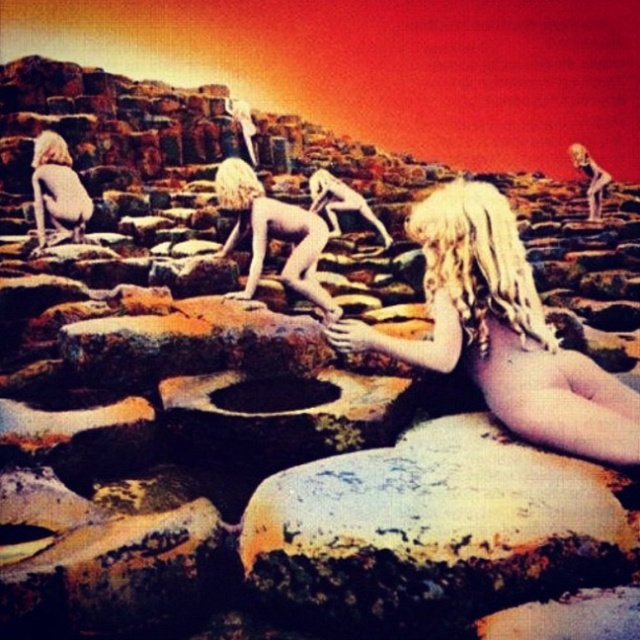
Between point (275, 211) and point (579, 163), which one is positioned behind?

Point (579, 163)

Which is more to the left, smooth skin girl at center or blonde hair at upper right?

Positioned to the left is smooth skin girl at center.

Where is `smooth skin girl at center`? This screenshot has height=640, width=640. smooth skin girl at center is located at coordinates (273, 234).

Is point (80, 182) positioned after point (573, 157)?

No, (80, 182) is closer to viewer.

Between point (65, 220) and point (577, 168), which one is positioned in front?

Point (65, 220) is more forward.

I want to click on blonde hair at left, so click(58, 189).

Who is shorter, blonde curly hair at center or blonde hair at upper left?

Standing shorter between the two is blonde hair at upper left.

From the picture: Does blonde curly hair at center appear under blonde hair at upper left?

Indeed, blonde curly hair at center is positioned under blonde hair at upper left.

The height and width of the screenshot is (640, 640). I want to click on blonde curly hair at center, so tap(477, 260).